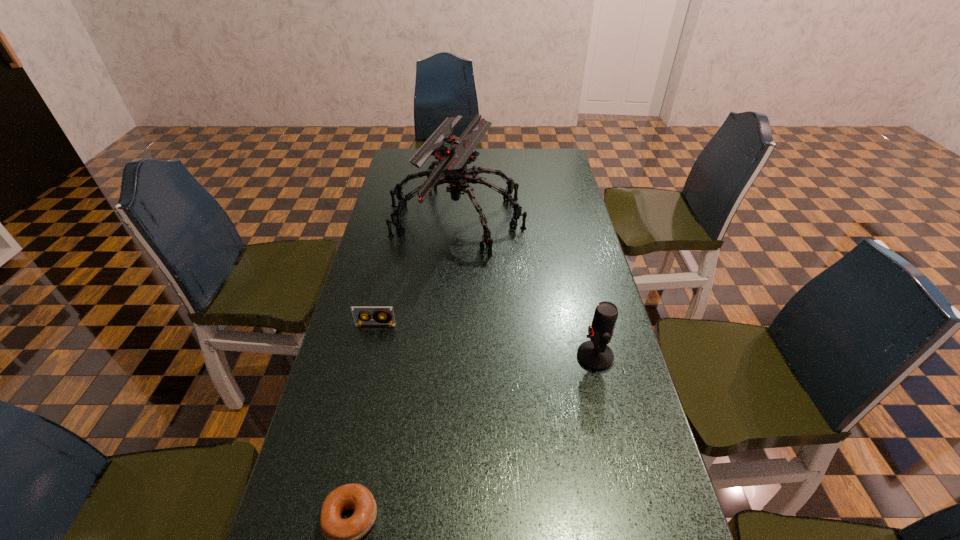
At what (x,y) coordinates should I click in order to perform the action: click on vacant space located 0.140m at the front of the videotape with visible reels. Please return your answer as a coordinate pair (x, y). The image size is (960, 540). Looking at the image, I should click on (366, 369).

At what (x,y) coordinates should I click in order to perform the action: click on drone that is at the left edge. Please return your answer as a coordinate pair (x, y). The image size is (960, 540). Looking at the image, I should click on (453, 155).

Find the location of `videotape present at the left edge`. videotape present at the left edge is located at coordinates (358, 312).

Where is `object located in the right edge section of the desktop`? object located in the right edge section of the desktop is located at coordinates (594, 354).

The image size is (960, 540). In order to click on free space at the left edge of the desktop in this screenshot , I will do `click(370, 390)`.

What are the coordinates of `vacant space at the right edge` in the screenshot? It's located at (555, 250).

You are a GUI agent. You are given a task and a screenshot of the screen. Output one action in this format:
    pyautogui.click(x=<x>, y=<y>)
    Task: Click on the vacant area at the far left corner
    The image size is (960, 540).
    Given the screenshot: What is the action you would take?
    pyautogui.click(x=416, y=150)

In the image, there is a desktop. What are the coordinates of `vacant space at the far right corner` in the screenshot? It's located at (532, 173).

This screenshot has height=540, width=960. In order to click on free spot between the third farthest object and the videotape in this screenshot , I will do `click(486, 341)`.

Image resolution: width=960 pixels, height=540 pixels. I want to click on empty location between the drone and the second shortest object, so click(x=416, y=271).